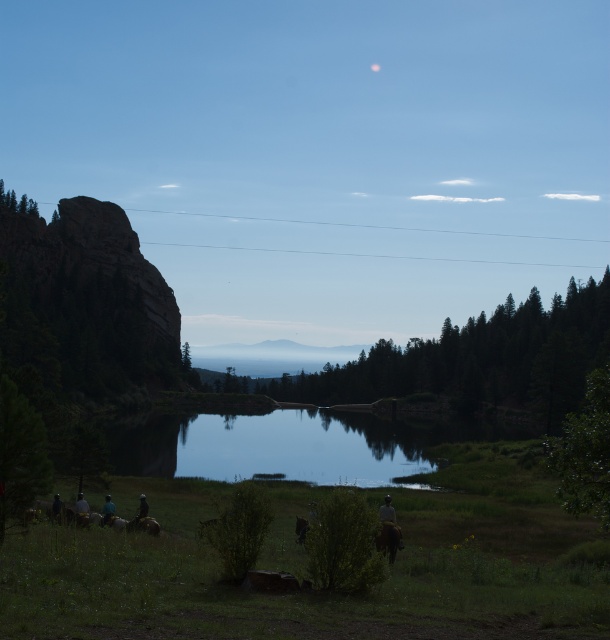
Does green leafy tree at right have a larger size compared to green matte tree at center?

Correct, green leafy tree at right is larger in size than green matte tree at center.

Is point (600, 438) farther from viewer compared to point (188, 356)?

No, (600, 438) is in front of (188, 356).

Where is `green leafy tree at right`? green leafy tree at right is located at coordinates (586, 452).

Is point (187, 365) less distant than point (76, 497)?

No, it is not.

Between point (183, 358) and point (77, 513), which one is positioned behind?

Point (183, 358)

Where is `green matte tree at center`? This screenshot has width=610, height=640. green matte tree at center is located at coordinates (185, 356).

Who is positioned more to the left, green textured tree at center or green matte tree at lower left?

green matte tree at lower left is more to the left.

Which of these two, green textured tree at center or green matte tree at lower left, stands shorter?

green matte tree at lower left

Where is `green textured tree at center`? green textured tree at center is located at coordinates (479, 360).